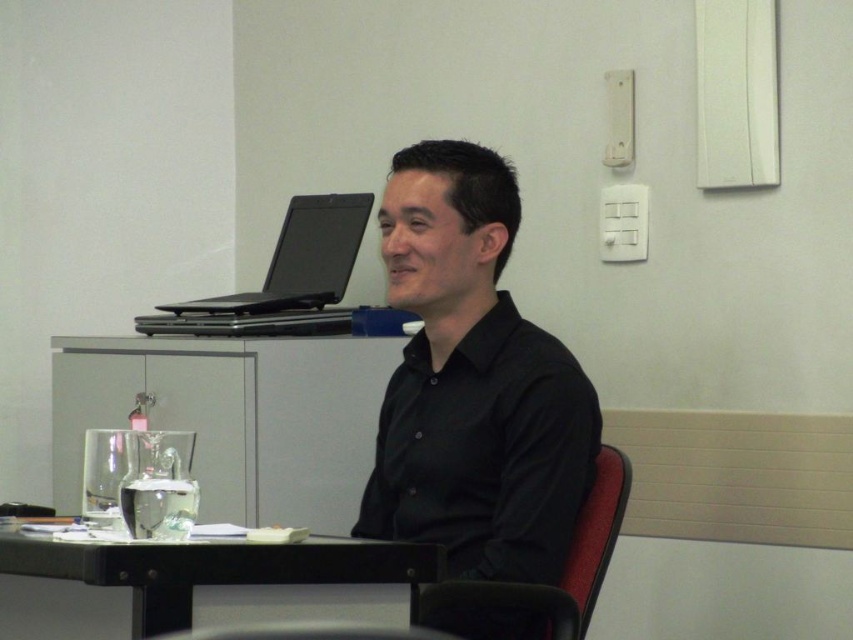
You are organizing a meeting in this conference room. You need to place a large presentation binder on the table. Which object, the black glossy table at lower left or the fabric textured chair at center, has enough space to accommodate the binder?

The fabric textured chair at center has more space to accommodate the large presentation binder since it is larger than the black glossy table at lower left.

From the picture: You are a person sitting in the fabric textured chair at center. You want to reach the black glossy table at lower left. Is the table within your immediate reach from your current position?

The black glossy table at lower left is in front of the fabric textured chair at center, so it should be within immediate reach.

You are a photographer setting up for a portrait shoot in the conference room. You need to ensure that the black matte shirt at center and the fabric textured chair at center are both visible in the frame. Based on their positions, which object is closer to the left edge of the photo?

The black matte shirt at center is positioned on the left side of the fabric textured chair at center, so it is closer to the left edge of the photo.